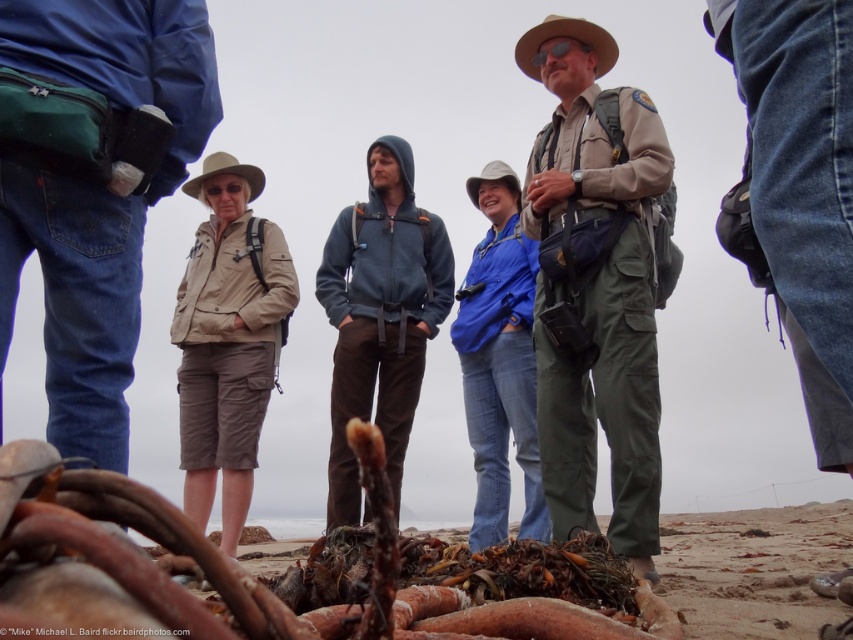
Based on the photo, which is more to the left, denim pants at lower left or brown fabric cowboy hat at upper center?

denim pants at lower left is more to the left.

This screenshot has height=640, width=853. I want to click on denim pants at lower left, so [93, 184].

Who is more distant from viewer, (x=94, y=378) or (x=570, y=32)?

The point (x=570, y=32) is behind.

Find the location of a particular element. Image resolution: width=853 pixels, height=640 pixels. denim pants at lower left is located at coordinates (93, 184).

Which is below, denim pants at lower left or brown organic debris at lower center?

brown organic debris at lower center

Locate an element on the screen. The image size is (853, 640). denim pants at lower left is located at coordinates (93, 184).

At what (x,y) coordinates should I click in order to perform the action: click on denim pants at lower left. Please return your answer as a coordinate pair (x, y). Looking at the image, I should click on (93, 184).

Does matte blue hoodie at center have a greater height compared to white fabric cowboy hat at center?

Yes.

Describe the element at coordinates (380, 316) in the screenshot. I see `matte blue hoodie at center` at that location.

Which is in front, point (410, 296) or point (482, 173)?

Point (410, 296) is more forward.

I want to click on matte blue hoodie at center, so click(x=380, y=316).